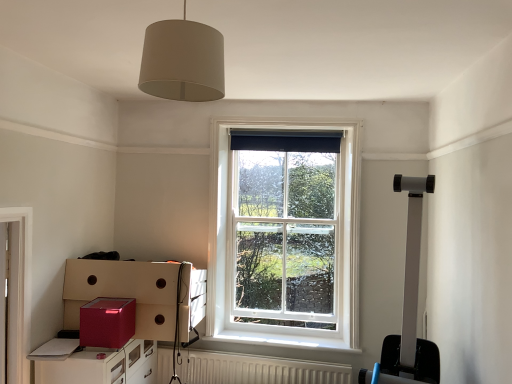
At what (x,y) coordinates should I click in order to perform the action: click on free point below black fabric curtain at upper center (from a real-world perspective). Please return your answer as a coordinate pair (x, y). The image size is (512, 384). Looking at the image, I should click on (276, 336).